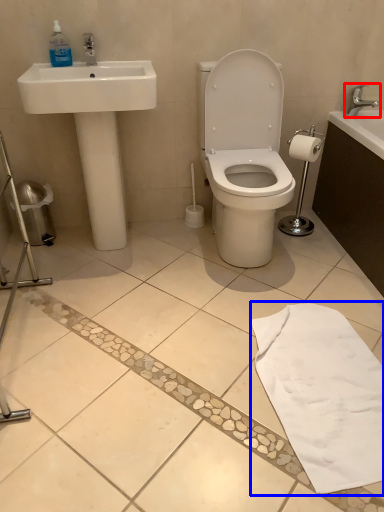
Question: Which object is further to the camera taking this photo, tap (highlighted by a red box) or bath towel (highlighted by a blue box)?

Choices:
 (A) tap
 (B) bath towel

Answer: (A)